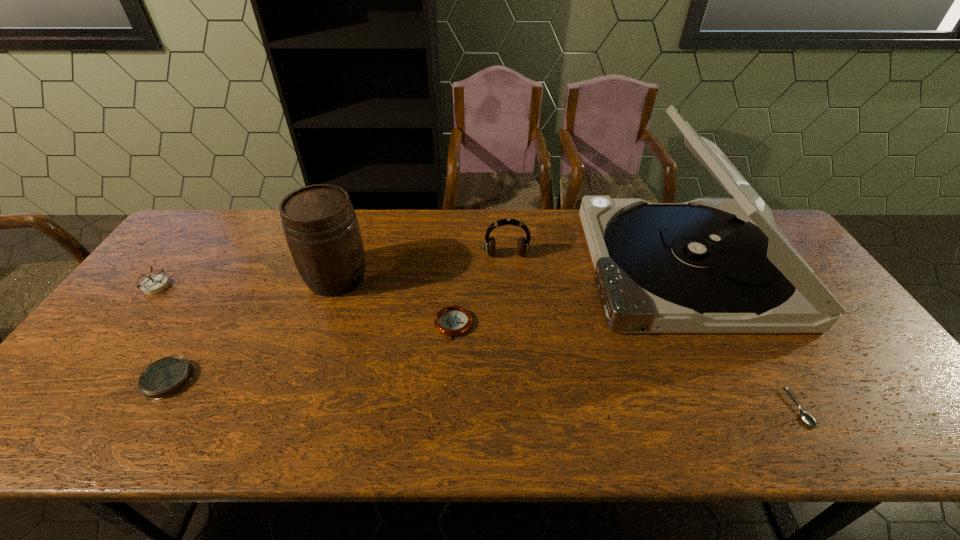
Find the location of a particular element. The height and width of the screenshot is (540, 960). the tallest object is located at coordinates (708, 265).

Find the location of a particular element. the sixth shortest object is located at coordinates (319, 222).

This screenshot has width=960, height=540. In order to click on the fifth object from right to left in this screenshot , I will do `click(319, 222)`.

Where is `headset`? The height and width of the screenshot is (540, 960). headset is located at coordinates (523, 244).

Where is `the fifth object from left to right`? This screenshot has height=540, width=960. the fifth object from left to right is located at coordinates (523, 244).

The height and width of the screenshot is (540, 960). I want to click on the leftmost compass, so click(x=155, y=284).

Where is `the leftmost object`? The height and width of the screenshot is (540, 960). the leftmost object is located at coordinates (155, 284).

Where is `the rightmost compass`? The height and width of the screenshot is (540, 960). the rightmost compass is located at coordinates tap(453, 320).

Where is `the second nearest compass`? This screenshot has height=540, width=960. the second nearest compass is located at coordinates pyautogui.click(x=453, y=320).

This screenshot has width=960, height=540. What are the coordinates of `the second compass from right to left` in the screenshot? It's located at (167, 376).